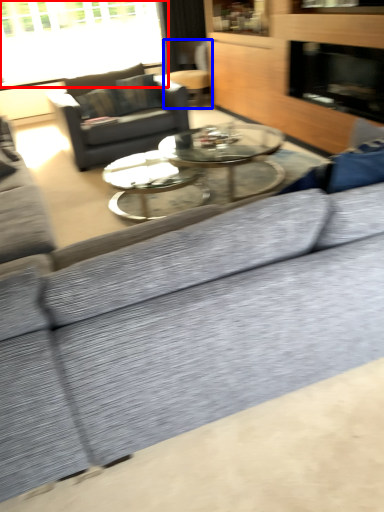
Question: Which object is closer to the camera taking this photo, window (highlighted by a red box) or swivel chair (highlighted by a blue box)?

Choices:
 (A) window
 (B) swivel chair

Answer: (A)